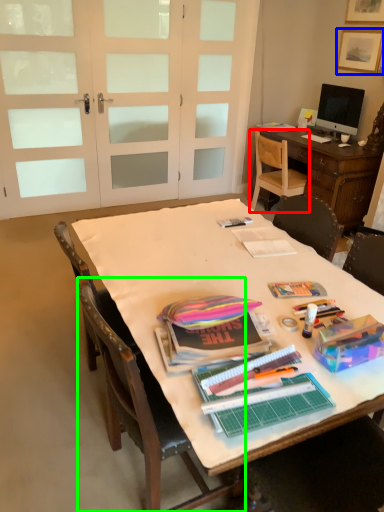
Question: Estimate the real-world distances between objects in this image. Which object is farther from chair (highlighted by a red box), picture frame (highlighted by a blue box) or chair (highlighted by a green box)?

Choices:
 (A) picture frame
 (B) chair

Answer: (B)